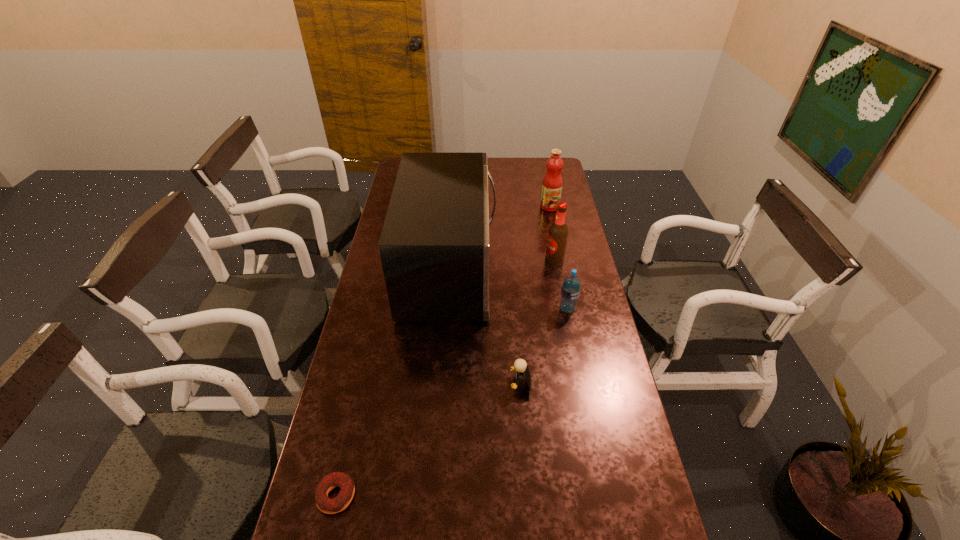
Where is `the tallest object`? the tallest object is located at coordinates (434, 247).

Where is `the second object from left to right`? The height and width of the screenshot is (540, 960). the second object from left to right is located at coordinates (434, 247).

Identify the location of the farthest object. This screenshot has width=960, height=540. (552, 183).

Identify the location of beer bottle. The height and width of the screenshot is (540, 960). (558, 231).

You are a GUI agent. You are given a task and a screenshot of the screen. Output one action in this format:
    pyautogui.click(x=<x>, y=<y>)
    Task: Click on the water bottle
    The image size is (960, 540).
    Given the screenshot: What is the action you would take?
    pyautogui.click(x=570, y=291)

You are a GUI agent. You are given a task and a screenshot of the screen. Output one action in this format:
    pyautogui.click(x=<x>, y=<y>)
    Task: Click on the Lego
    The image size is (960, 540).
    Given the screenshot: What is the action you would take?
    pyautogui.click(x=520, y=368)

This screenshot has width=960, height=540. Find the location of `the fifth farthest object`. the fifth farthest object is located at coordinates (520, 368).

Image resolution: width=960 pixels, height=540 pixels. What are the coordinates of `doughnut` in the screenshot? It's located at (325, 504).

Identify the location of the leftmost object. The width and height of the screenshot is (960, 540). (325, 504).

Locate an element on the screen. Image resolution: width=960 pixels, height=540 pixels. vacant area situated 0.340m with the door open on the microwave oven is located at coordinates [x=583, y=269].